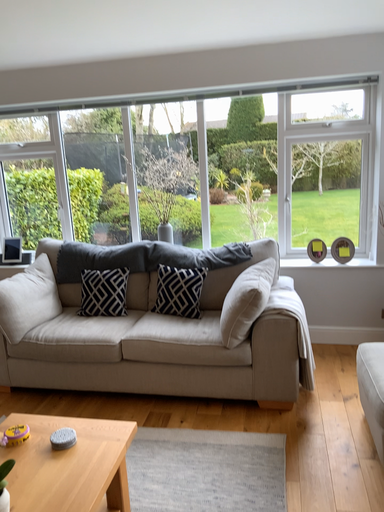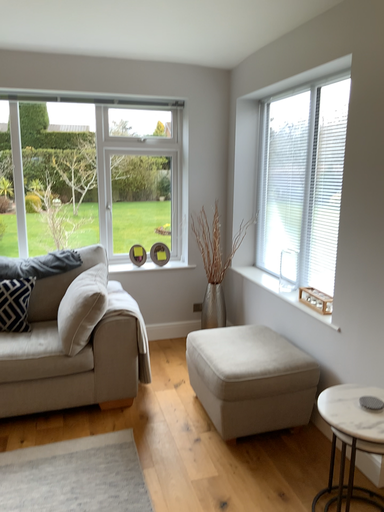
Question: How did the camera likely rotate when shooting the video?

Choices:
 (A) rotated left
 (B) rotated right

Answer: (B)